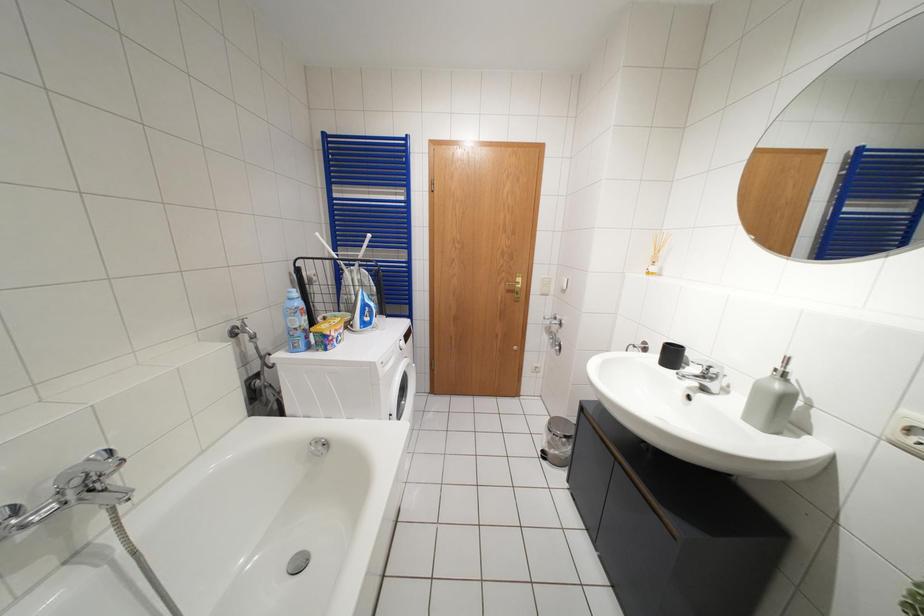
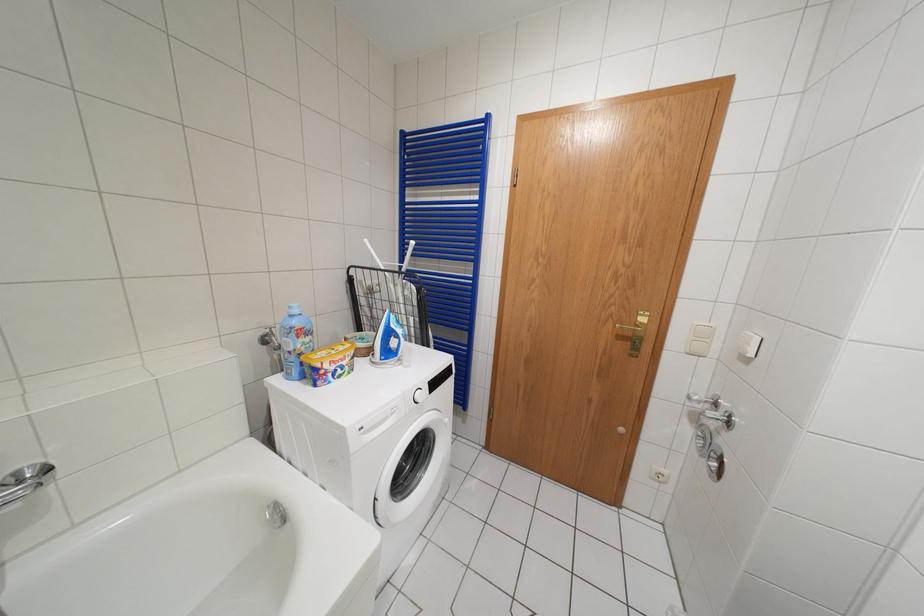
Question: What movement of the cameraman would produce the second image?

Choices:
 (A) Left
 (B) Right
 (C) Forward
 (D) Backward

Answer: (C)